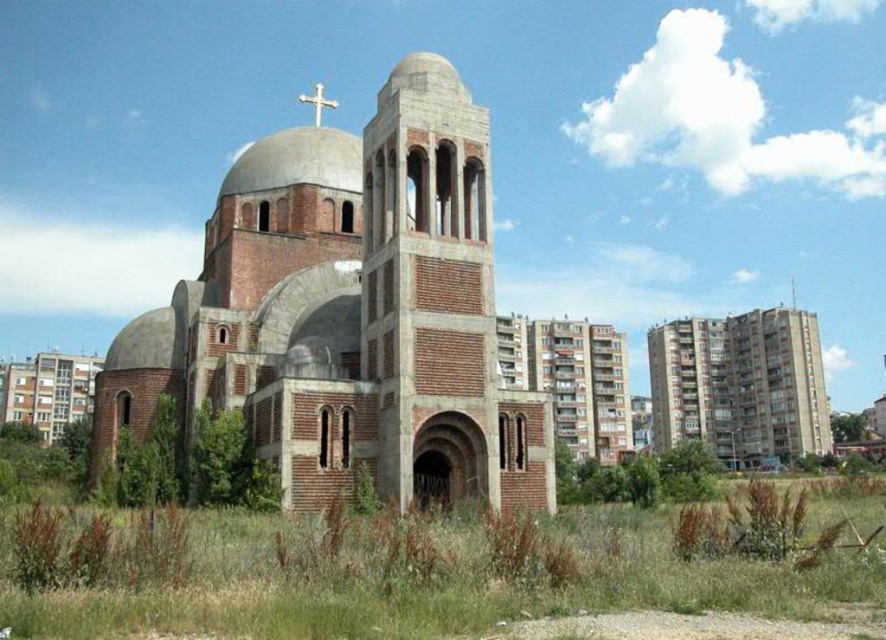
Between red brick chapel at center and concrete building at right, which one has more height?

concrete building at right

Who is lower down, red brick chapel at center or concrete building at right?

Positioned lower is concrete building at right.

I want to click on red brick chapel at center, so click(x=350, y=312).

Does point (68, 364) lie in front of point (316, 97)?

No, (68, 364) is behind (316, 97).

Who is more distant from viewer, (94, 356) or (319, 120)?

The point (94, 356) is behind.

Find the location of a particular element. brick church at left is located at coordinates (47, 392).

Does red brick chapel at center appear over brick church at left?

Correct, red brick chapel at center is located above brick church at left.

Is red brick chapel at center further to the viewer compared to brick church at left?

No, it is not.

Measure the distance between point (269, 296) and camera.

The distance of point (269, 296) from camera is 57.01 meters.

Identify the location of red brick chapel at center. The image size is (886, 640). click(350, 312).